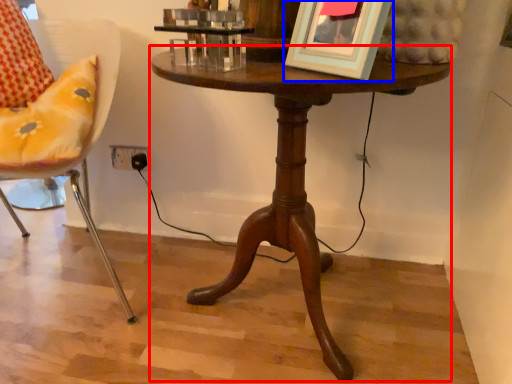
Question: Which point is further to the camera, table (highlighted by a red box) or picture frame (highlighted by a blue box)?

Choices:
 (A) table
 (B) picture frame

Answer: (A)